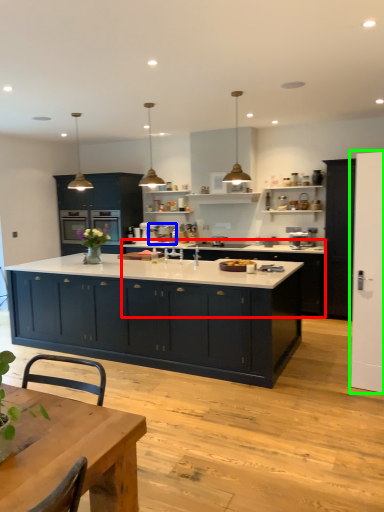
Question: Estimate the real-world distances between objects in this image. Which object is closer to cabinetry (highlighted by a red box), appliance (highlighted by a blue box) or screen door (highlighted by a green box)?

Choices:
 (A) appliance
 (B) screen door

Answer: (A)